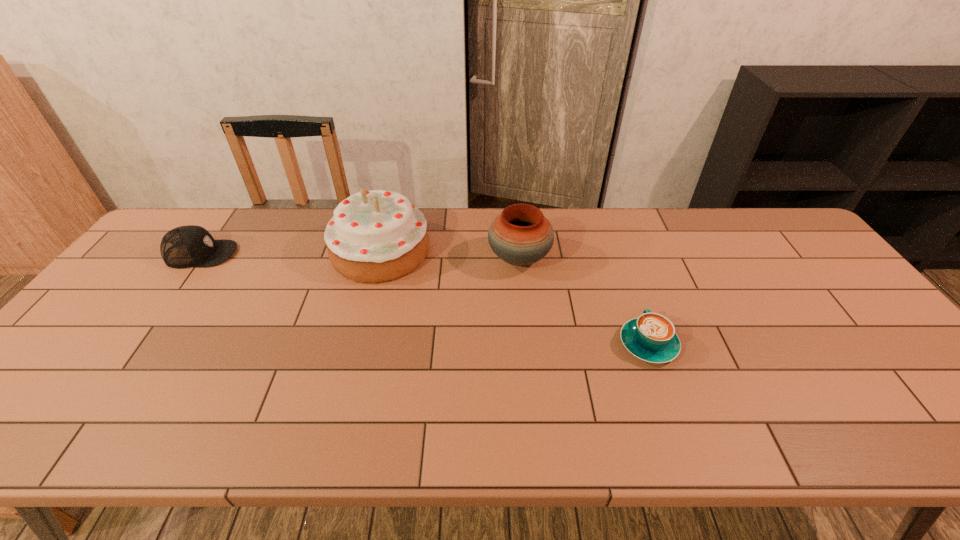
Find the location of `vacant space located 0.250m on the front-facing side of the third tallest object`. vacant space located 0.250m on the front-facing side of the third tallest object is located at coordinates (318, 254).

Locate an element on the screen. vacant space located with the handle on the right side of the shortest object is located at coordinates (614, 247).

Identify the location of vacant position located 0.060m with the handle on the right side of the shortest object. This screenshot has height=540, width=960. (635, 306).

At what (x,y) coordinates should I click in order to perform the action: click on vacant space positioned with the handle on the right side of the shortest object. Please return your answer as a coordinate pair (x, y). Looking at the image, I should click on (618, 257).

Where is `cake at the far edge`? cake at the far edge is located at coordinates (375, 236).

Image resolution: width=960 pixels, height=540 pixels. What are the coordinates of `pottery at the far edge` in the screenshot? It's located at (520, 235).

The image size is (960, 540). I want to click on cap situated at the far edge, so pyautogui.click(x=187, y=246).

Identify the location of object at the left edge. Image resolution: width=960 pixels, height=540 pixels. (187, 246).

Find the location of a particular element. object located at the far left corner is located at coordinates point(187,246).

You are a GUI agent. You are given a task and a screenshot of the screen. Output one action in this format:
    pyautogui.click(x=<x>, y=<y>)
    Task: Click on the vacant point at the far edge
    The height and width of the screenshot is (540, 960).
    Given the screenshot: What is the action you would take?
    pyautogui.click(x=561, y=242)